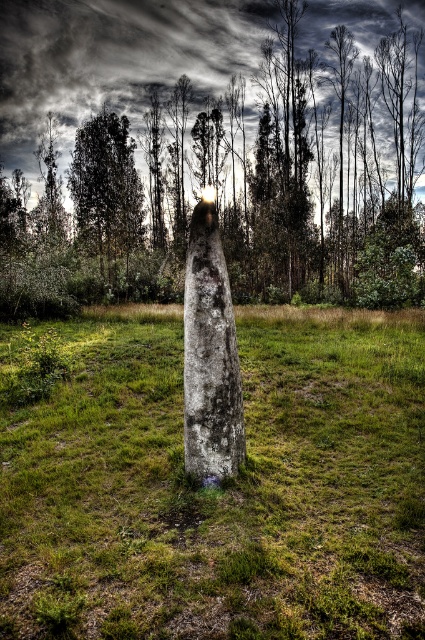
Between point (252, 244) and point (197, 324), which one is positioned behind?

The point (252, 244) is behind.

Can you confirm if smooth gray stone at center is positioned below gray weathered stone at center?

No.

The image size is (425, 640). Describe the element at coordinates (207, 144) in the screenshot. I see `smooth gray stone at center` at that location.

Where is `smooth gray stone at center`? Image resolution: width=425 pixels, height=640 pixels. smooth gray stone at center is located at coordinates (207, 144).

Who is more forward, (351, 310) or (186, 193)?

Point (351, 310) is in front.

Which is more to the left, white stone pillar at center or smooth gray stone at center?

smooth gray stone at center is more to the left.

Locate an element on the screen. Image resolution: width=425 pixels, height=640 pixels. white stone pillar at center is located at coordinates pyautogui.click(x=220, y=488).

Is white stone pillar at center bigger than gray weathered stone at center?

Yes, white stone pillar at center is bigger than gray weathered stone at center.

Measure the distance between white stone pillar at center and camera.

white stone pillar at center is 4.04 meters away from camera.

This screenshot has width=425, height=640. In order to click on white stone pillar at center in this screenshot , I will do `click(220, 488)`.